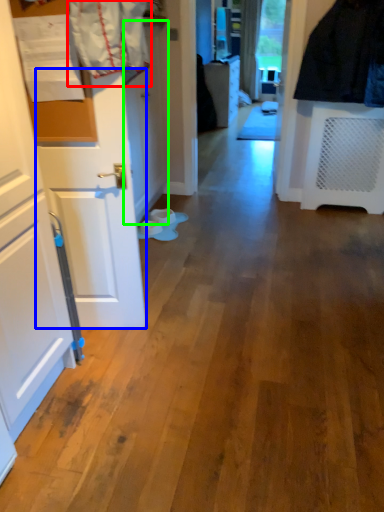
Question: Which object is positioned closest to laundry (highlighted by a red box)? Select from door (highlighted by a blue box) and door (highlighted by a green box).

Choices:
 (A) door
 (B) door

Answer: (A)